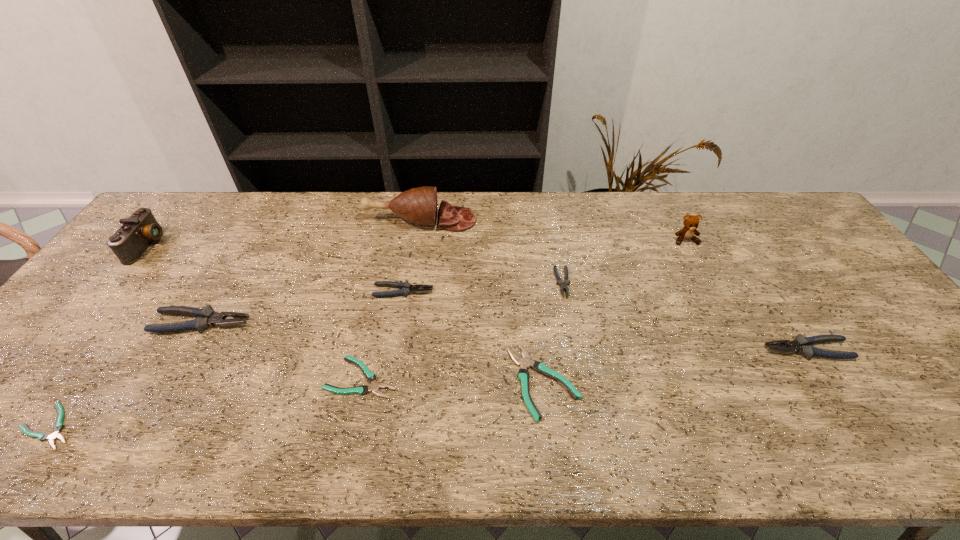
This screenshot has width=960, height=540. What are the coordinates of `object that is the closest to the leftmost object` in the screenshot? It's located at (206, 317).

Where is `object identified as the ninth closest to the tallest object`? The width and height of the screenshot is (960, 540). object identified as the ninth closest to the tallest object is located at coordinates (803, 345).

Select which pliers is the fifth closest to the rightmost object. Please provide its 2D coordinates. Your answer should be formatted as a tuple, i.e. [(x, y)], where the tuple contains the x and y coordinates of a point satisfying the conditions above.

[(206, 317)]

Locate an element on the screen. pliers that is the third closest one to the nearest gray pliers is located at coordinates (406, 288).

Locate an element on the screen. gray pliers that stands as the closest to the sixth tallest object is located at coordinates (206, 317).

Locate which gray pliers is the closest to the second shortest pliers. Please provide its 2D coordinates. Your answer should be formatted as a tuple, i.e. [(x, y)], where the tuple contains the x and y coordinates of a point satisfying the conditions above.

[(406, 288)]

Select which teal pliers is the closest to the smallest teal pliers. Please provide its 2D coordinates. Your answer should be formatted as a tuple, i.e. [(x, y)], where the tuple contains the x and y coordinates of a point satisfying the conditions above.

[(370, 376)]

At what (x,y) coordinates should I click in order to perform the action: click on the closest teal pliers relative to the brown teddy bear. Please return your answer as a coordinate pair (x, y). Looking at the image, I should click on (523, 375).

Locate an element on the screen. The image size is (960, 540). vacant space that satisfies the following two spatial constraints: 1. at the gripping part of the fifth shortest object; 2. on the back side of the third shortest object is located at coordinates (388, 381).

You are a GUI agent. You are given a task and a screenshot of the screen. Output one action in this format:
    pyautogui.click(x=<x>, y=<y>)
    Task: Click on the vacant area that satisfies the following two spatial constraints: 1. on the front-facing side of the brown teddy bear; 2. on the lens of the camera
    
    Given the screenshot: What is the action you would take?
    pyautogui.click(x=688, y=245)